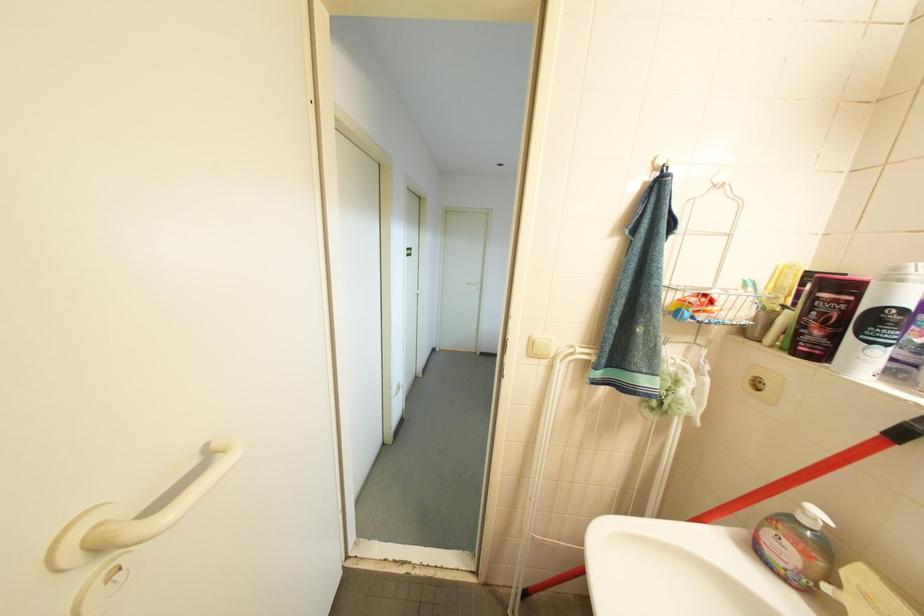
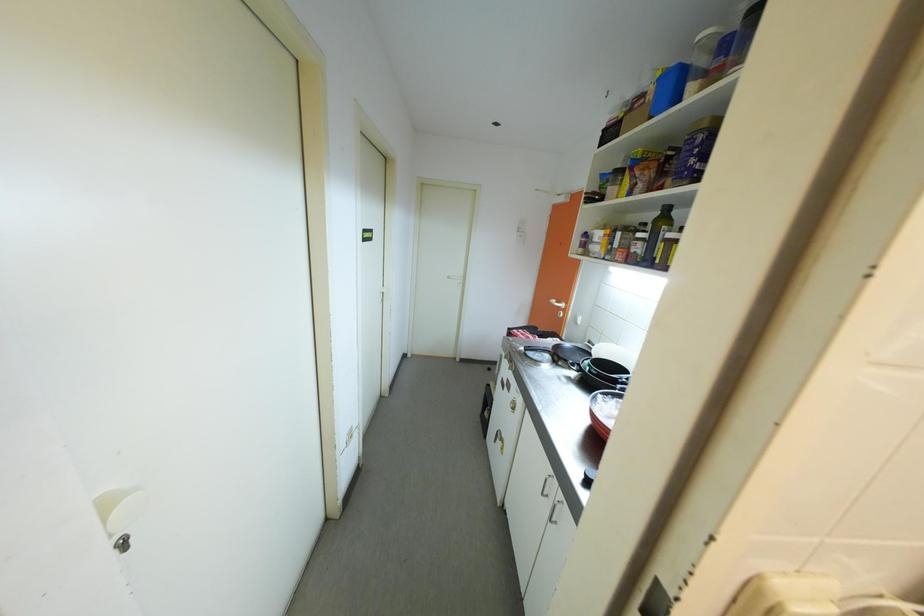
Question: How did the camera likely rotate?

Choices:
 (A) Left
 (B) Right
 (C) Up
 (D) Down

Answer: (B)